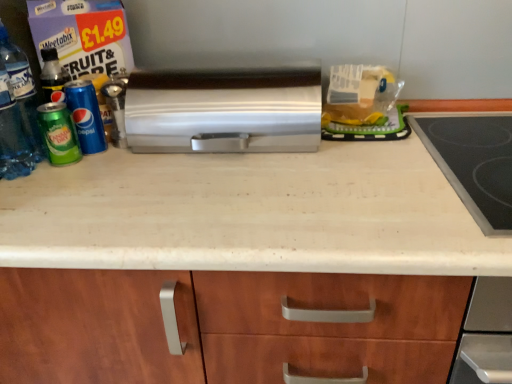
Question: Considering the positions of satin silver toaster at center and green matte can at left, positioned as the 1th beverage in right-to-left order, in the image, is satin silver toaster at center wider or thinner than green matte can at left, positioned as the 1th beverage in right-to-left order,?

Choices:
 (A) thin
 (B) wide

Answer: (B)

Question: From a real-world perspective, is satin silver toaster at center positioned above or below green matte can at left, the 2th beverage in the left-to-right sequence?

Choices:
 (A) below
 (B) above

Answer: (B)

Question: Estimate the real-world distances between objects in this image. Which object is farther from the white laminate countertop at center?

Choices:
 (A) satin silver toaster at center
 (B) green matte can at left, the 1th beverage positioned from the left
 (C) black glass cooktop at right
 (D) translucent plastic bottle at left
 (E) green matte can at left, the 2th beverage in the left-to-right sequence

Answer: (D)

Question: Estimate the real-world distances between objects in this image. Which object is farther from the translucent plastic bag at upper center?

Choices:
 (A) green matte can at left, which is the 2th beverage from right to left
 (B) black glass cooktop at right
 (C) green matte can at left, the 2th beverage in the left-to-right sequence
 (D) satin silver toaster at center
 (E) translucent plastic bottle at left

Answer: (E)